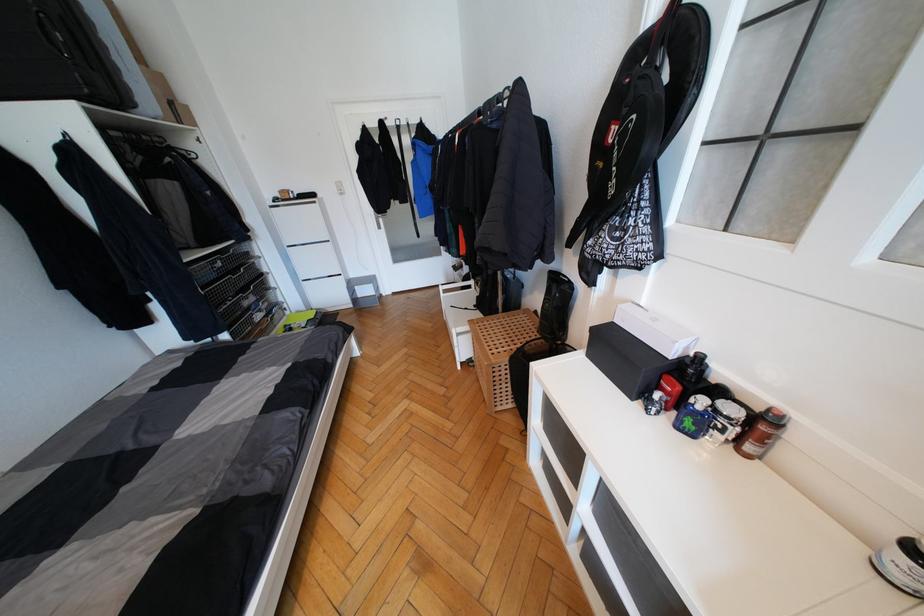
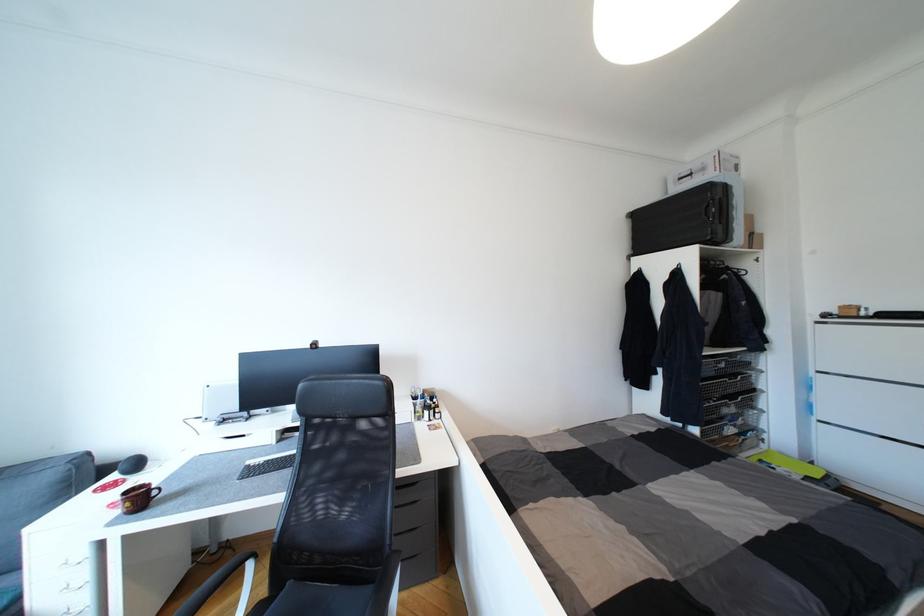
Question: The camera is either moving clockwise (left) or counter-clockwise (right) around the object. The first image is from the beginning of the video and the second image is from the end. Is the camera moving left or right when shooting the video?

Choices:
 (A) Left
 (B) Right

Answer: (B)